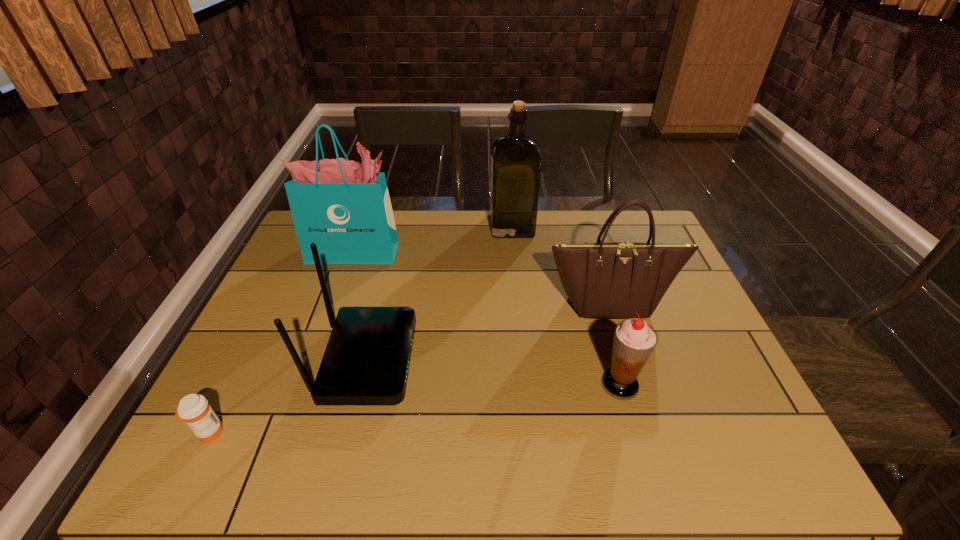
Where is `vacant point located between the nearest object and the shopping bag`? This screenshot has height=540, width=960. vacant point located between the nearest object and the shopping bag is located at coordinates (282, 343).

You are a GUI agent. You are given a task and a screenshot of the screen. Output one action in this format:
    pyautogui.click(x=<x>, y=<y>)
    Task: Click on the free spot between the liquor and the smoothie
    The height and width of the screenshot is (540, 960).
    Given the screenshot: What is the action you would take?
    pyautogui.click(x=566, y=305)

This screenshot has width=960, height=540. In order to click on free point between the medicine and the third shortest object in this screenshot , I will do click(288, 397).

Where is `unoccupied position between the nearest object and the router`? unoccupied position between the nearest object and the router is located at coordinates (288, 397).

Find the location of a particular element. This screenshot has height=540, width=960. free space between the fifth tallest object and the router is located at coordinates (493, 372).

This screenshot has height=540, width=960. Identify the location of free area in between the router and the farthest object. (440, 293).

At what (x,y) coordinates should I click in order to perform the action: click on empty space between the router and the fifth tallest object. Please return your answer as a coordinate pair (x, y). The height and width of the screenshot is (540, 960). Looking at the image, I should click on (493, 372).

Select which object is the second closest to the handbag. Please provide its 2D coordinates. Your answer should be formatted as a tuple, i.e. [(x, y)], where the tuple contains the x and y coordinates of a point satisfying the conditions above.

[(516, 158)]

The height and width of the screenshot is (540, 960). Find the location of `object that is the second closest to the third tallest object`. object that is the second closest to the third tallest object is located at coordinates (516, 158).

The height and width of the screenshot is (540, 960). I want to click on free space that satisfies the following two spatial constraints: 1. on the front-facing side of the smoothie; 2. on the right side of the fourth tallest object, so click(x=361, y=384).